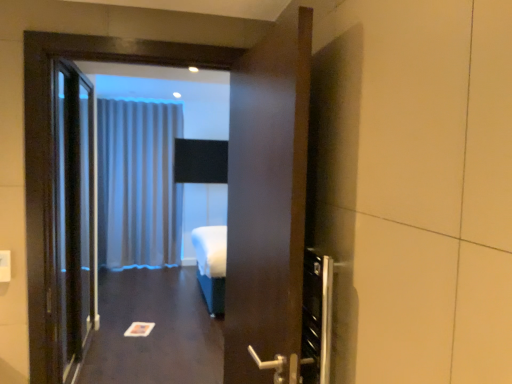
Where is `satin fabric curtain at center`? satin fabric curtain at center is located at coordinates (x=138, y=184).

From the image's perspective, is satin fabric curtain at center on top of black glass elevator door at left?

Yes.

From the picture: Is satin fabric curtain at center oriented away from black glass elevator door at left?

No, satin fabric curtain at center's orientation is not away from black glass elevator door at left.

Considering the sizes of objects satin fabric curtain at center and black glass elevator door at left in the image provided, who is thinner, satin fabric curtain at center or black glass elevator door at left?

With smaller width is black glass elevator door at left.

Does satin fabric curtain at center come behind black glass elevator door at left?

Yes, satin fabric curtain at center is further from the camera.

Is satin fabric curtain at center turned away from white glossy paper at center?

satin fabric curtain at center is not turned away from white glossy paper at center.

From a real-world perspective, is satin fabric curtain at center under white glossy paper at center?

No.

Is satin fabric curtain at center inside or outside of white glossy paper at center?

satin fabric curtain at center lies outside white glossy paper at center.

How distant is white glossy paper at center from black glass elevator door at left?

white glossy paper at center is 37.71 inches from black glass elevator door at left.

Based on the photo, can you confirm if white glossy paper at center is thinner than black glass elevator door at left?

Incorrect, the width of white glossy paper at center is not less than that of black glass elevator door at left.

Is white glossy paper at center bigger than black glass elevator door at left?

Yes.

Could you tell me if white glossy paper at center is turned towards black glass elevator door at left?

No, white glossy paper at center is not oriented towards black glass elevator door at left.

In the scene shown: Considering the sizes of objects white glossy paper at center and satin fabric curtain at center in the image provided, who is shorter, white glossy paper at center or satin fabric curtain at center?

white glossy paper at center is shorter.

From a real-world perspective, which object rests below the other?

white glossy paper at center.

Does white glossy paper at center have a lesser width compared to satin fabric curtain at center?

No, white glossy paper at center is not thinner than satin fabric curtain at center.

In the scene shown: How much distance is there between white glossy paper at center and satin fabric curtain at center?

white glossy paper at center is 4.77 feet away from satin fabric curtain at center.

Considering the relative sizes of black glass elevator door at left and white glossy paper at center in the image provided, is black glass elevator door at left wider than white glossy paper at center?

Incorrect, the width of black glass elevator door at left does not surpass that of white glossy paper at center.

What's the angular difference between black glass elevator door at left and white glossy paper at center's facing directions?

There is a 88.6-degree angle between the facing directions of black glass elevator door at left and white glossy paper at center.

Is black glass elevator door at left facing away from white glossy paper at center?

No, white glossy paper at center is not at the back of black glass elevator door at left.

From the image's perspective, between black glass elevator door at left and white glossy paper at center, which one is located above?

From the image's view, black glass elevator door at left is above.

Can you confirm if black glass elevator door at left is taller than satin fabric curtain at center?

No.

Considering the positions of objects black glass elevator door at left and satin fabric curtain at center in the image provided, who is more to the right, black glass elevator door at left or satin fabric curtain at center?

From the viewer's perspective, black glass elevator door at left appears more on the right side.

Who is smaller, black glass elevator door at left or satin fabric curtain at center?

Smaller between the two is black glass elevator door at left.

Which is further, [94,279] or [125,236]?

The point [125,236] is farther from the camera.

Identify the location of elevator door below the satin fabric curtain at center (from a real-world perspective). This screenshot has width=512, height=384. (75, 215).

This screenshot has height=384, width=512. I want to click on corridor in front of the satin fabric curtain at center, so click(154, 330).

Estimate the real-world distances between objects in this image. Which object is closer to satin fabric curtain at center, black glass elevator door at left or white glossy paper at center?

white glossy paper at center.

From the image, which object appears to be nearer to black glass elevator door at left, satin fabric curtain at center or white glossy paper at center?

The object closer to black glass elevator door at left is white glossy paper at center.

Consider the image. Based on their spatial positions, is white glossy paper at center or black glass elevator door at left further from satin fabric curtain at center?

black glass elevator door at left is positioned further to the anchor satin fabric curtain at center.

When comparing their distances from white glossy paper at center, does satin fabric curtain at center or black glass elevator door at left seem further?

satin fabric curtain at center is positioned further to the anchor white glossy paper at center.

Which object lies further to the anchor point black glass elevator door at left, white glossy paper at center or satin fabric curtain at center?

satin fabric curtain at center lies further to black glass elevator door at left than the other object.

From the image, which object appears to be nearer to white glossy paper at center, black glass elevator door at left or satin fabric curtain at center?

Based on the image, black glass elevator door at left appears to be nearer to white glossy paper at center.

Where is `corridor between black glass elevator door at left and satin fabric curtain at center in the front-back direction`? corridor between black glass elevator door at left and satin fabric curtain at center in the front-back direction is located at coordinates point(154,330).